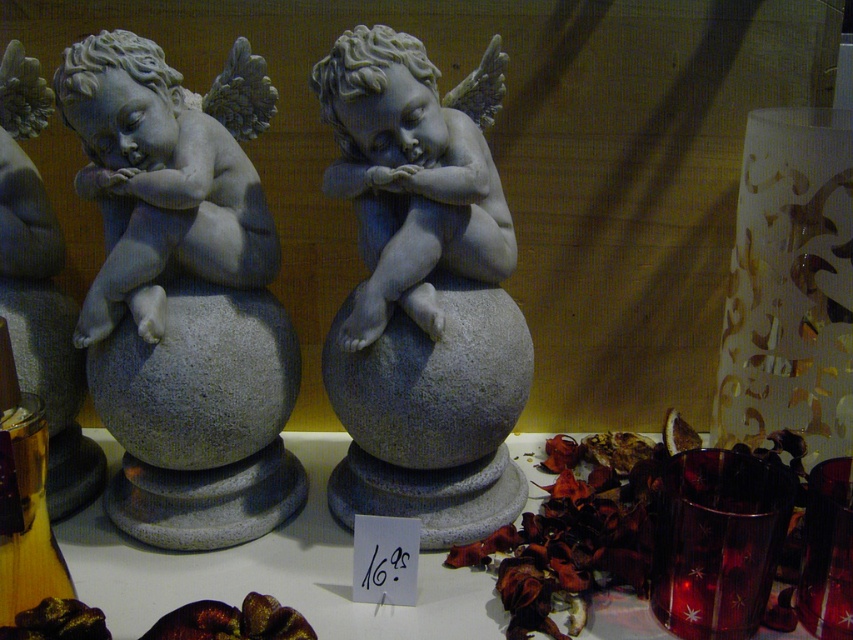
Who is positioned more to the left, matte stone cherub at center or white stone cherub at center?

matte stone cherub at center is more to the left.

The width and height of the screenshot is (853, 640). What are the coordinates of `matte stone cherub at center` in the screenshot? It's located at (183, 296).

Is white stone cherub at center in front of wooden bottle at lower left?

No, white stone cherub at center is behind wooden bottle at lower left.

Is point (381, 161) less distant than point (3, 483)?

No.

At what (x,y) coordinates should I click in order to perform the action: click on white stone cherub at center. Please return your answer as a coordinate pair (x, y). The height and width of the screenshot is (640, 853). Looking at the image, I should click on (422, 292).

How far apart are matte stone cherub at center and wooden bottle at lower left?

They are 9.97 inches apart.

Does matte stone cherub at center have a greater height compared to wooden bottle at lower left?

Yes.

Between point (128, 115) and point (19, 548), which one is positioned in front?

Point (19, 548) is in front.

Where is `matte stone cherub at center`? This screenshot has width=853, height=640. matte stone cherub at center is located at coordinates (183, 296).